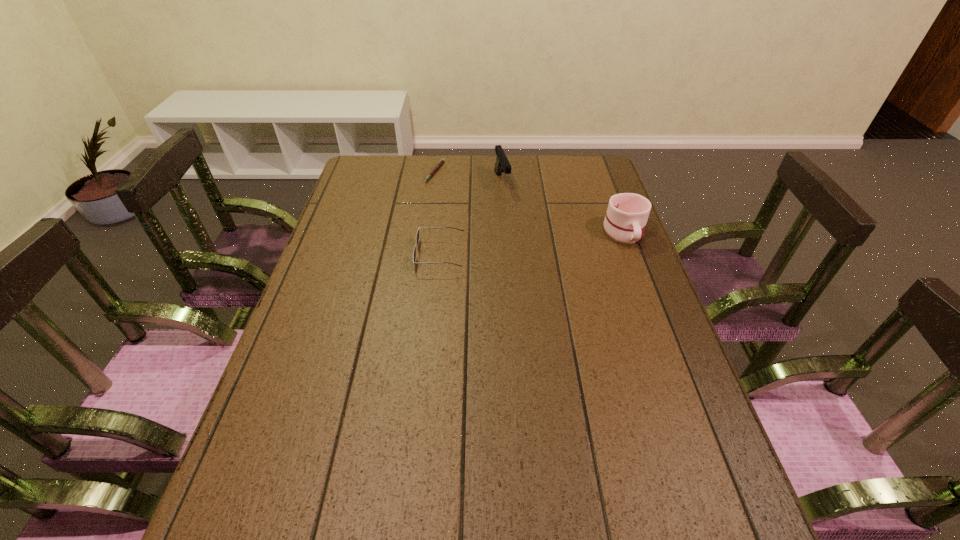
In the image, there is a desktop. Identify the location of vacant space at the right edge. The width and height of the screenshot is (960, 540). (612, 275).

Where is `vacant space at the far right corner`? vacant space at the far right corner is located at coordinates (582, 183).

Where is `vacant area between the sunglasses and the pistol`? Image resolution: width=960 pixels, height=540 pixels. vacant area between the sunglasses and the pistol is located at coordinates (471, 218).

Locate an element on the screen. This screenshot has width=960, height=540. vacant space in between the sunglasses and the pen is located at coordinates (438, 213).

This screenshot has height=540, width=960. Identify the location of unoccupied area between the mug and the pistol. (563, 207).

Locate an element on the screen. The width and height of the screenshot is (960, 540). unoccupied area between the second object from right to left and the sunglasses is located at coordinates (471, 218).

Where is `unoccupied area between the mug and the sunglasses`? Image resolution: width=960 pixels, height=540 pixels. unoccupied area between the mug and the sunglasses is located at coordinates (532, 244).

Where is `free point between the rightmost object and the second object from right to left`? The height and width of the screenshot is (540, 960). free point between the rightmost object and the second object from right to left is located at coordinates (563, 207).

What are the coordinates of `vacant space that is in between the sunglasses and the pistol` in the screenshot? It's located at (471, 218).

Find the location of a particular element. The image size is (960, 540). free spot between the sunglasses and the shortest object is located at coordinates (438, 213).